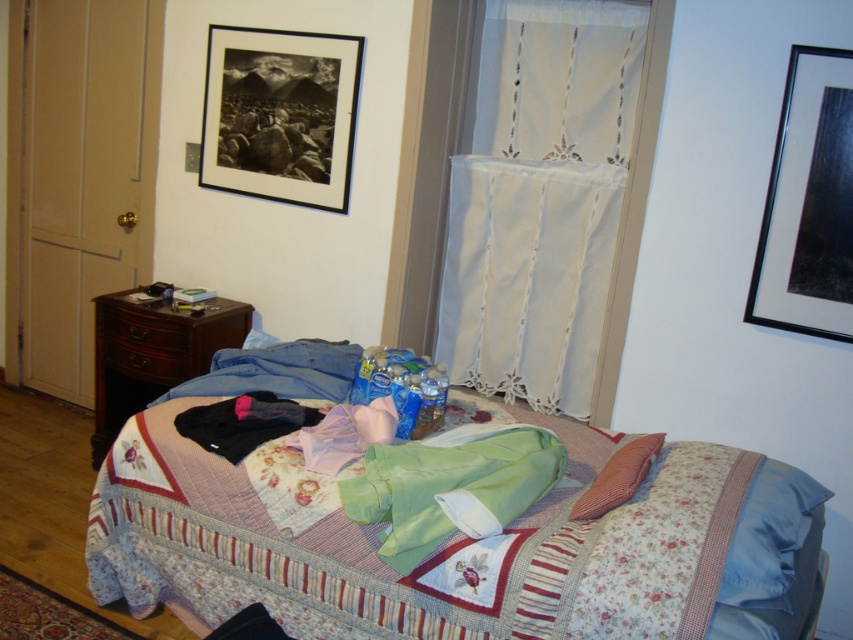
You are organizing the items on the bed and need to place the black fabric at center and the pink fabric pillow at center. Which item has a larger width?

The black fabric at center has a larger width than the pink fabric pillow at center.